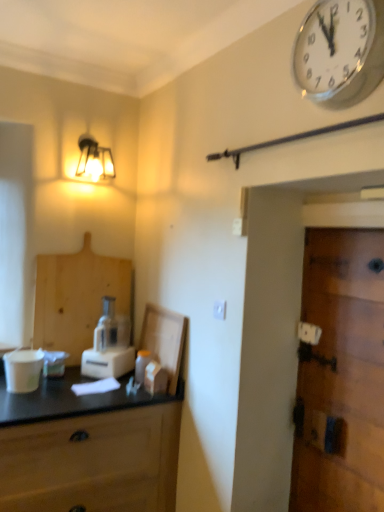
Question: In terms of width, does white glossy wall clock at upper right look wider or thinner when compared to white plastic blender at center?

Choices:
 (A) thin
 (B) wide

Answer: (A)

Question: From a real-world perspective, is white glossy wall clock at upper right physically located above or below white plastic blender at center?

Choices:
 (A) below
 (B) above

Answer: (B)

Question: Estimate the real-world distances between objects in this image. Which object is closer to the translucent plastic bottle at center?

Choices:
 (A) wooden cutting board at left
 (B) matte glass lamp at upper left
 (C) white plastic electric outlet at center
 (D) wooden door at right
 (E) white glossy wall clock at upper right

Answer: (A)

Question: Which object is the closest to the translucent plastic bottle at center?

Choices:
 (A) wooden door at right
 (B) white plastic electric outlet at center
 (C) white glossy wall clock at upper right
 (D) white plastic blender at center
 (E) wooden cutting board at left

Answer: (D)